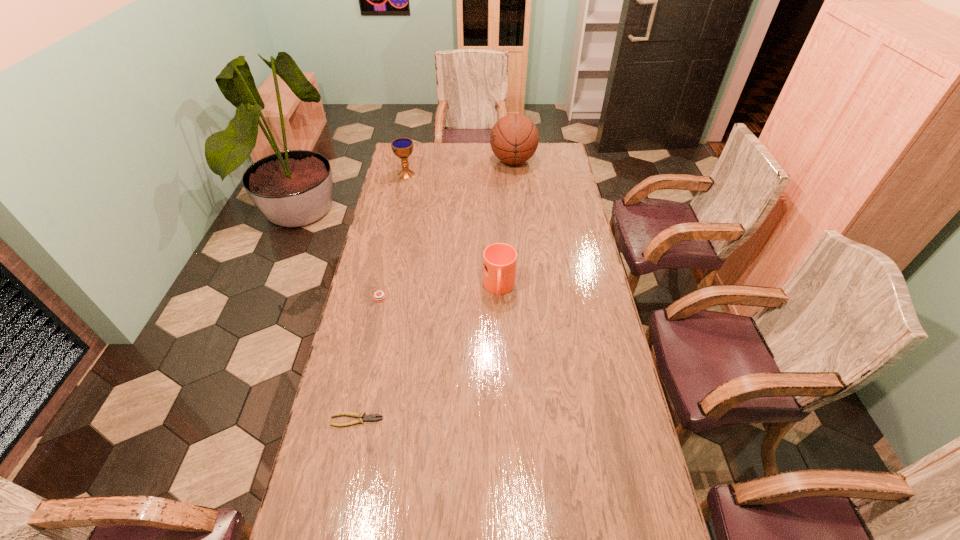
At what (x,y) coordinates should I click in order to perform the action: click on vacant space located on the handle side of the mug. Please return your answer as a coordinate pair (x, y). Looking at the image, I should click on (501, 340).

You are a GUI agent. You are given a task and a screenshot of the screen. Output one action in this format:
    pyautogui.click(x=<x>, y=<y>)
    Task: Click on the vacant space located on the right of the fourth tallest object
    This screenshot has width=960, height=540.
    Given the screenshot: What is the action you would take?
    pyautogui.click(x=443, y=298)

Where is `vacant region located 0.100m on the front of the pliers`? This screenshot has height=540, width=960. vacant region located 0.100m on the front of the pliers is located at coordinates (348, 462).

This screenshot has height=540, width=960. What are the coordinates of `object at the far edge` in the screenshot? It's located at (514, 138).

Where is `chalice that is positioned at the left edge`? Image resolution: width=960 pixels, height=540 pixels. chalice that is positioned at the left edge is located at coordinates (402, 147).

Find the location of a particular element. chocolate cake that is at the left edge is located at coordinates (381, 296).

Where is `pliers present at the left edge`? pliers present at the left edge is located at coordinates (371, 417).

At what (x,y) coordinates should I click in order to perform the action: click on object that is at the right edge. Please return your answer as a coordinate pair (x, y). This screenshot has width=960, height=540. Looking at the image, I should click on (514, 138).

Locate an element on the screen. This screenshot has height=540, width=960. object that is at the far right corner is located at coordinates (514, 138).

The height and width of the screenshot is (540, 960). In the image, there is a desktop. Identify the location of vacant space at the far edge. (449, 151).